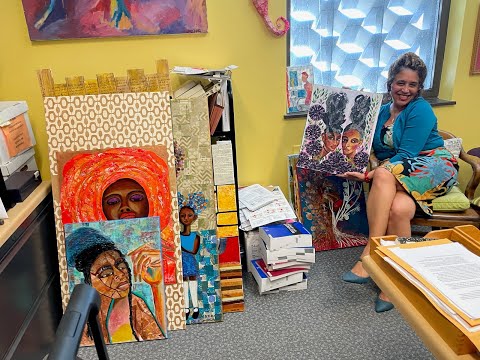
What are the coordinates of `box` in the screenshot? It's located at (20, 134).